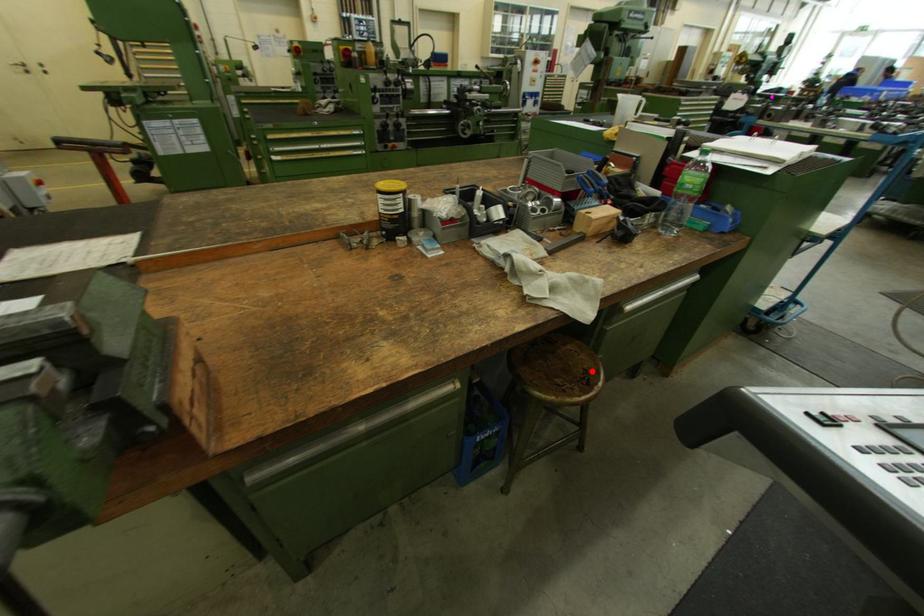
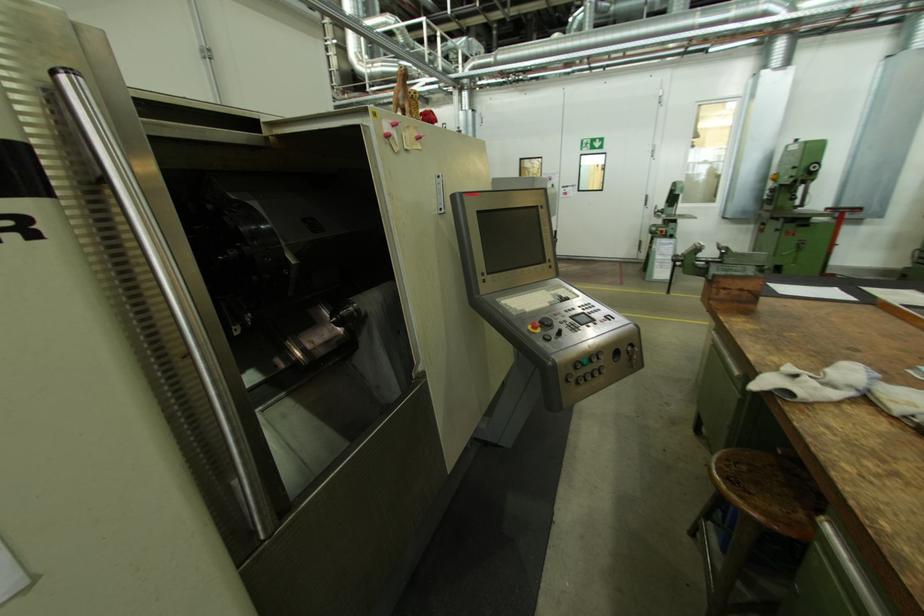
The point at the highlighted location is marked in the first image. Where is the corresponding point in the second image?

(755, 493)